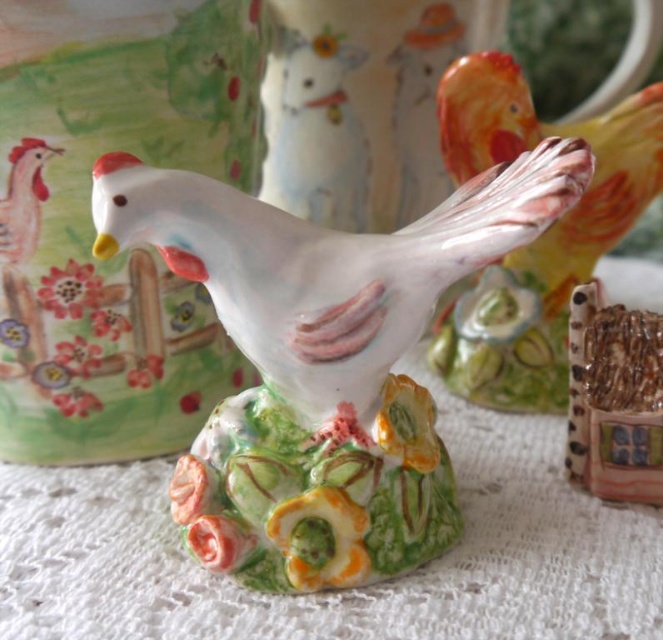
Between white glossy ceramic chicken at center and porcelain glossy chicken at upper right, which one is positioned higher?

porcelain glossy chicken at upper right is above.

Does white glossy ceramic chicken at center have a greater height compared to porcelain glossy chicken at upper right?

No, white glossy ceramic chicken at center is not taller than porcelain glossy chicken at upper right.

Between point (516, 188) and point (554, 125), which one is positioned in front?

Point (516, 188) is more forward.

Locate an element on the screen. white glossy ceramic chicken at center is located at coordinates (324, 362).